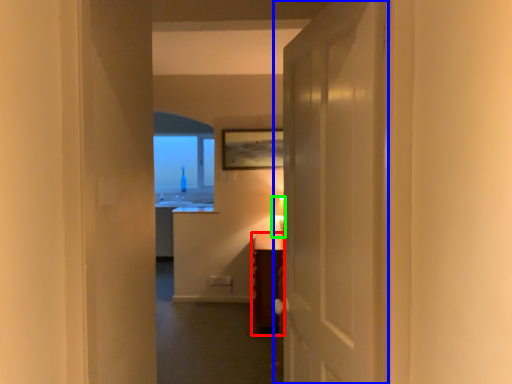
Question: Based on their relative distances, which object is nearer to vanity (highlighted by a red box)? Choose from door (highlighted by a blue box) and table lamp (highlighted by a green box).

Choices:
 (A) door
 (B) table lamp

Answer: (B)